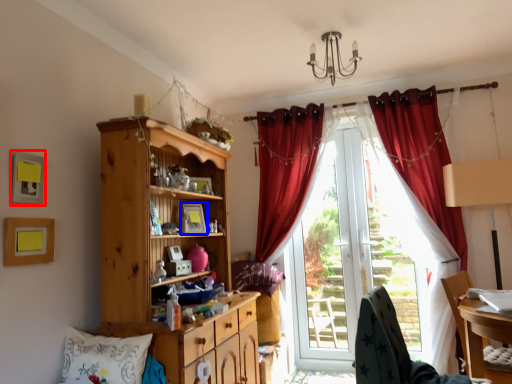
Question: Which object is closer to the camera taking this photo, picture frame (highlighted by a red box) or picture frame (highlighted by a blue box)?

Choices:
 (A) picture frame
 (B) picture frame

Answer: (A)